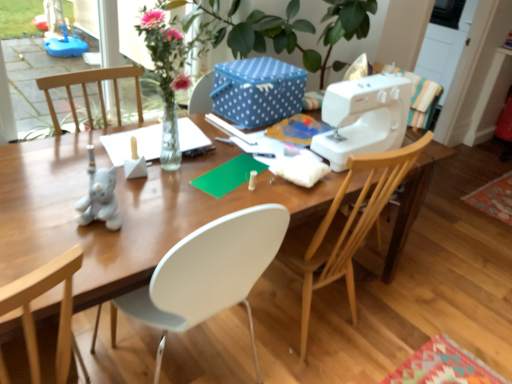
Question: Would you say wooden chair at right is inside or outside blue dotted fabric box at upper center?

Choices:
 (A) inside
 (B) outside

Answer: (B)

Question: In terms of height, does wooden chair at right look taller or shorter compared to blue dotted fabric box at upper center?

Choices:
 (A) short
 (B) tall

Answer: (B)

Question: Estimate the real-world distances between objects in this image. Which object is closer to the white plastic sewing machine at right?

Choices:
 (A) blue dotted fabric box at upper center
 (B) wooden desk at center
 (C) wooden chair at right

Answer: (C)

Question: Considering the real-world distances, which object is closest to the white plastic sewing machine at right?

Choices:
 (A) wooden desk at center
 (B) blue dotted fabric box at upper center
 (C) wooden chair at right

Answer: (C)